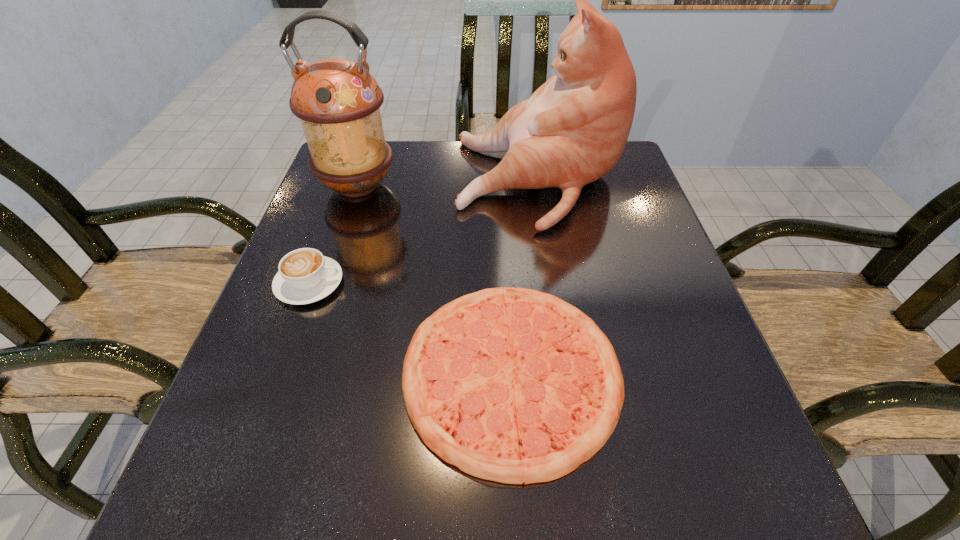
The width and height of the screenshot is (960, 540). Find the location of `free space at the left edge of the desktop`. free space at the left edge of the desktop is located at coordinates (297, 361).

This screenshot has height=540, width=960. Identify the location of vacant point at the right edge. (647, 247).

You are a GUI agent. You are given a task and a screenshot of the screen. Output one action in this format:
    pyautogui.click(x=<x>, y=<y>)
    Task: Click on the unoccupied position between the oil lamp and the pizza
    This screenshot has height=540, width=960.
    Given the screenshot: What is the action you would take?
    [x=435, y=279]

At what (x,y) coordinates should I click in order to perform the action: click on vacant area that lies between the shortest object and the cat. Please return your answer as a coordinate pair (x, y). This screenshot has height=540, width=960. Looking at the image, I should click on click(x=525, y=277).

Identify the location of vacant area between the cappuccino and the pizza. (411, 328).

Locate an element on the screen. This screenshot has height=540, width=960. free space between the pizza and the oil lamp is located at coordinates (435, 279).

I want to click on empty space that is in between the shortest object and the cat, so (x=525, y=277).

Locate an element on the screen. The image size is (960, 540). unoccupied position between the oil lamp and the cat is located at coordinates (448, 184).

Identify the location of vacant space that's between the cat and the pizza. (525, 277).

This screenshot has width=960, height=540. I want to click on vacant space that is in between the oil lamp and the pizza, so click(435, 279).